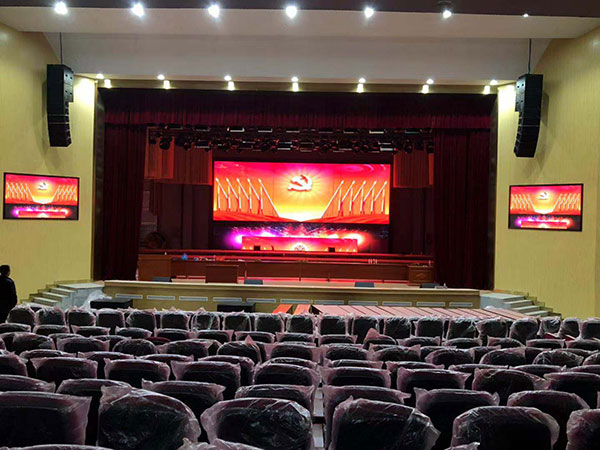
Find the location of a particular element. big screen is located at coordinates (319, 190).